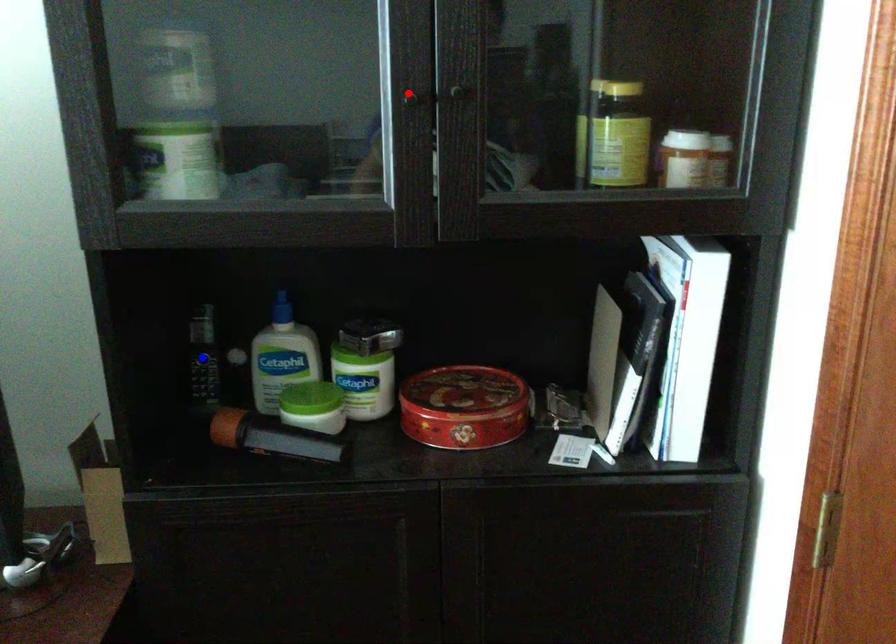
Question: Which of the two points in the image is closer to the camera?

Choices:
 (A) Blue point is closer.
 (B) Red point is closer.

Answer: (B)